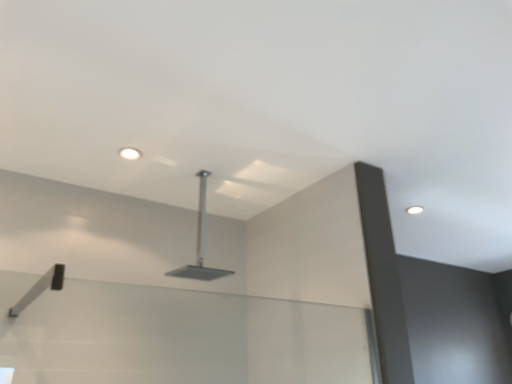
Question: Could you tell me if satin silver showerhead at center is facing matte white droplight at upper center, placed as the 1th droplight when sorted from left to right?

Choices:
 (A) yes
 (B) no

Answer: (B)

Question: Does satin silver showerhead at center have a larger size compared to matte white droplight at upper center, the 1th droplight viewed from the top?

Choices:
 (A) no
 (B) yes

Answer: (B)

Question: From a real-world perspective, is satin silver showerhead at center physically above matte white droplight at upper center, the 1th droplight viewed from the top?

Choices:
 (A) no
 (B) yes

Answer: (A)

Question: Can you confirm if satin silver showerhead at center is wider than matte white droplight at upper center, which ranks as the 1th droplight in front-to-back order?

Choices:
 (A) yes
 (B) no

Answer: (A)

Question: Can you confirm if satin silver showerhead at center is shorter than matte white droplight at upper center, placed as the 1th droplight when sorted from left to right?

Choices:
 (A) no
 (B) yes

Answer: (A)

Question: Is satin silver showerhead at center behind matte white droplight at upper center, which ranks as the 2th droplight in bottom-to-top order?

Choices:
 (A) yes
 (B) no

Answer: (B)

Question: Does matte white droplight at upper center, which ranks as the 1th droplight in front-to-back order, appear on the left side of satin silver showerhead at center?

Choices:
 (A) yes
 (B) no

Answer: (A)

Question: Does matte white droplight at upper center, which ranks as the 1th droplight in front-to-back order, have a lesser width compared to satin silver showerhead at center?

Choices:
 (A) yes
 (B) no

Answer: (A)

Question: Does matte white droplight at upper center, placed as the 1th droplight when sorted from left to right, have a lesser height compared to satin silver showerhead at center?

Choices:
 (A) yes
 (B) no

Answer: (A)

Question: Is matte white droplight at upper center, the second droplight viewed from the right, not close to satin silver showerhead at center?

Choices:
 (A) yes
 (B) no

Answer: (B)

Question: From a real-world perspective, is matte white droplight at upper center, which ranks as the 1th droplight in front-to-back order, beneath satin silver showerhead at center?

Choices:
 (A) yes
 (B) no

Answer: (B)

Question: Is matte white droplight at upper center, which ranks as the 2th droplight in bottom-to-top order, placed right next to satin silver showerhead at center?

Choices:
 (A) no
 (B) yes

Answer: (A)

Question: Is white glossy droplight at upper right, placed as the 2th droplight when sorted from left to right, facing away from matte white droplight at upper center, placed as the 1th droplight when sorted from left to right?

Choices:
 (A) yes
 (B) no

Answer: (B)